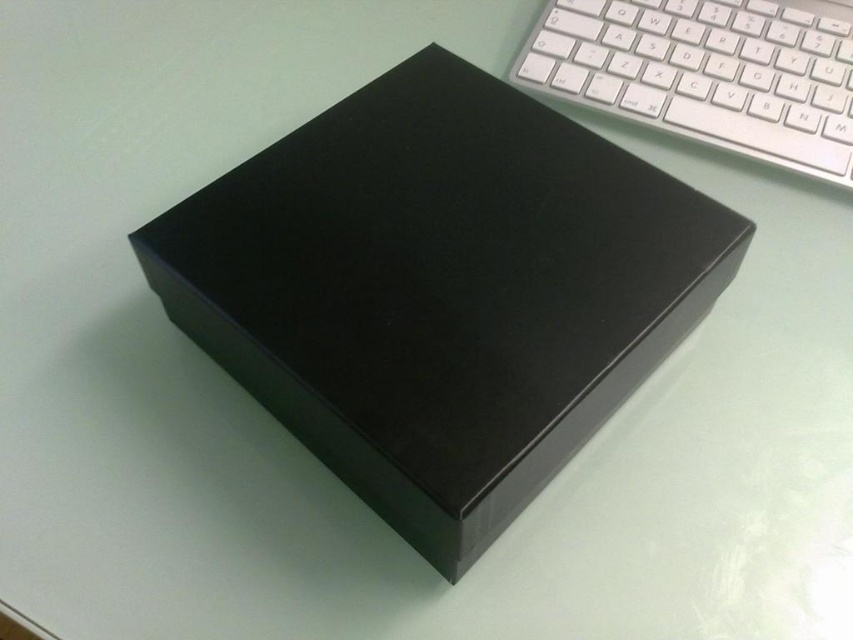
You need to place the matte black box at center onto the white plastic keyboard at upper right. Will the box fit entirely on the keyboard without overhanging the edges?

The matte black box at center might be wider than the white plastic keyboard at upper right, so there is a possibility that the box will overhang the edges of the keyboard if placed there.

You are organizing items on your desk and want to place both the matte black box at center and the white plastic keyboard at upper right. Given their sizes, which item should you prioritize moving to ensure there is enough space for both?

The matte black box at center is larger in size than the white plastic keyboard at upper right, so you should prioritize moving the matte black box at center first to accommodate both items.

You are organizing items on a desk and need to place the matte black box at center and the white plastic keyboard at upper right. Based on their current positions, which object is closer to the bottom edge of the desk?

The matte black box at center is closer to the bottom edge of the desk because it is positioned below the white plastic keyboard at upper right.